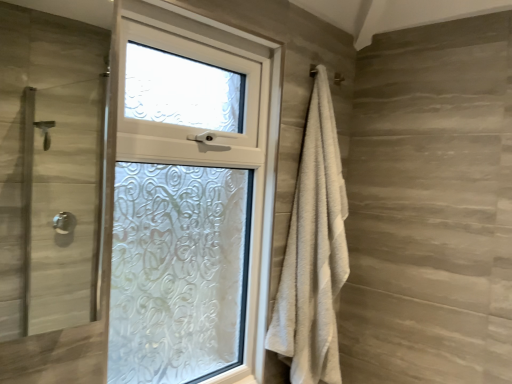
Describe the element at coordinates (313, 252) in the screenshot. I see `white textured towel at right` at that location.

In the scene shown: What is the approximate width of white textured towel at right?

It is 8.20 inches.

The image size is (512, 384). In order to click on white textured towel at right in this screenshot , I will do `click(313, 252)`.

Describe the element at coordinates (62, 203) in the screenshot. I see `clear glass shower door at left` at that location.

Measure the distance between clear glass shower door at left and camera.

The distance of clear glass shower door at left from camera is 4.73 feet.

I want to click on clear glass shower door at left, so click(x=62, y=203).

Where is `white textured towel at right`? The width and height of the screenshot is (512, 384). white textured towel at right is located at coordinates (313, 252).

Based on their positions, is white textured towel at right located to the left or right of clear glass shower door at left?

white textured towel at right is to the right of clear glass shower door at left.

Is white textured towel at right further to the viewer compared to clear glass shower door at left?

Yes, white textured towel at right is further from the camera.

Considering the positions of point (323, 180) and point (82, 219), is point (323, 180) closer or farther from the camera than point (82, 219)?

Point (323, 180) is closer to the camera than point (82, 219).

From the image's perspective, which one is positioned lower, white textured towel at right or clear glass shower door at left?

From the image's view, white textured towel at right is below.

From a real-world perspective, between white textured towel at right and clear glass shower door at left, who is vertically lower?

From a 3D spatial view, white textured towel at right is below.

Can you confirm if white textured towel at right is thinner than clear glass shower door at left?

Incorrect, the width of white textured towel at right is not less than that of clear glass shower door at left.

In terms of height, does white textured towel at right look taller or shorter compared to clear glass shower door at left?

Clearly, white textured towel at right is taller compared to clear glass shower door at left.

Between white textured towel at right and clear glass shower door at left, which one has smaller size?

clear glass shower door at left.

Is clear glass shower door at left surrounded by white textured towel at right?

Actually, clear glass shower door at left is outside white textured towel at right.

Is white textured towel at right far from clear glass shower door at left?

That's right, there is a large distance between white textured towel at right and clear glass shower door at left.

Is white textured towel at right facing away from clear glass shower door at left?

That's not correct — white textured towel at right is not looking away from clear glass shower door at left.

The image size is (512, 384). I want to click on bath towel that is behind the clear glass shower door at left, so click(313, 252).

Can you confirm if clear glass shower door at left is positioned to the left of white textured towel at right?

Yes.

Considering their positions, is clear glass shower door at left located in front of or behind white textured towel at right?

clear glass shower door at left is positioned closer to the viewer than white textured towel at right.

Does point (44, 291) come closer to viewer compared to point (313, 212)?

No, (44, 291) is further to viewer.

From the picture: From the image's perspective, is clear glass shower door at left located above white textured towel at right?

Yes, from the image's perspective, clear glass shower door at left is above white textured towel at right.

From a real-world perspective, between clear glass shower door at left and white textured towel at right, who is vertically higher?

In real-world perspective, clear glass shower door at left is above.

Considering the relative sizes of clear glass shower door at left and white textured towel at right in the image provided, is clear glass shower door at left wider than white textured towel at right?

In fact, clear glass shower door at left might be narrower than white textured towel at right.

Considering the relative sizes of clear glass shower door at left and white textured towel at right in the image provided, is clear glass shower door at left shorter than white textured towel at right?

Correct, clear glass shower door at left is not as tall as white textured towel at right.

Looking at this image, between clear glass shower door at left and white textured towel at right, which one has smaller size?

With smaller size is clear glass shower door at left.

Is clear glass shower door at left not inside white textured towel at right?

That's correct, clear glass shower door at left is outside of white textured towel at right.

Is clear glass shower door at left touching white textured towel at right?

clear glass shower door at left and white textured towel at right are clearly separated.

Could you tell me if clear glass shower door at left is turned towards white textured towel at right?

No.

How different are the orientations of clear glass shower door at left and white textured towel at right in degrees?

1.58 degrees separate the facing orientations of clear glass shower door at left and white textured towel at right.

Find the location of `screen door located above the white textured towel at right (from a real-world perspective)`. screen door located above the white textured towel at right (from a real-world perspective) is located at coordinates click(62, 203).

Locate an element on the screen. The height and width of the screenshot is (384, 512). bath towel directly beneath the clear glass shower door at left (from a real-world perspective) is located at coordinates (313, 252).

Locate an element on the screen. The image size is (512, 384). screen door on the left side of white textured towel at right is located at coordinates [x=62, y=203].